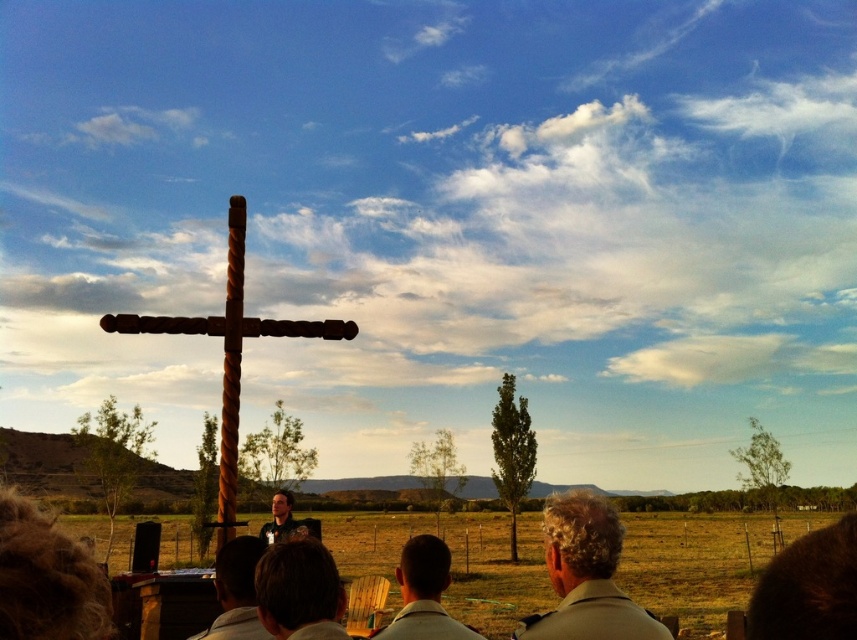
Is twisted wood cross at center shorter than light brown wooden chair at lower center?

Incorrect, twisted wood cross at center's height does not fall short of light brown wooden chair at lower center's.

Between twisted wood cross at center and light brown wooden chair at lower center, which one appears on the left side from the viewer's perspective?

Positioned to the left is twisted wood cross at center.

I want to click on twisted wood cross at center, so click(229, 353).

I want to click on twisted wood cross at center, so click(229, 353).

Does light beige shirt at center come in front of light brown wooden chair at lower center?

Yes, it is in front of light brown wooden chair at lower center.

The width and height of the screenshot is (857, 640). Describe the element at coordinates (586, 576) in the screenshot. I see `light beige shirt at center` at that location.

Locate an element on the screen. light beige shirt at center is located at coordinates (586, 576).

This screenshot has width=857, height=640. What are the coordinates of `light beige shirt at center` in the screenshot? It's located at (586, 576).

Measure the distance between twisted wood cross at center and dark brown hair at lower center.

They are 11.50 meters apart.

Based on the photo, between twisted wood cross at center and dark brown hair at lower center, which one appears on the left side from the viewer's perspective?

Positioned to the left is twisted wood cross at center.

Between point (117, 321) and point (289, 636), which one is positioned behind?

Positioned behind is point (117, 321).

Locate an element on the screen. This screenshot has width=857, height=640. twisted wood cross at center is located at coordinates (229, 353).